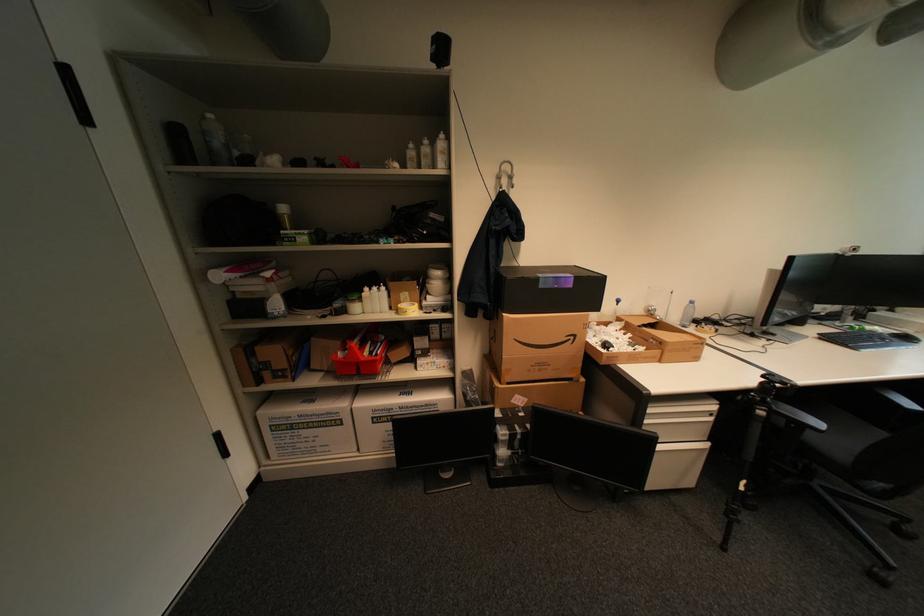
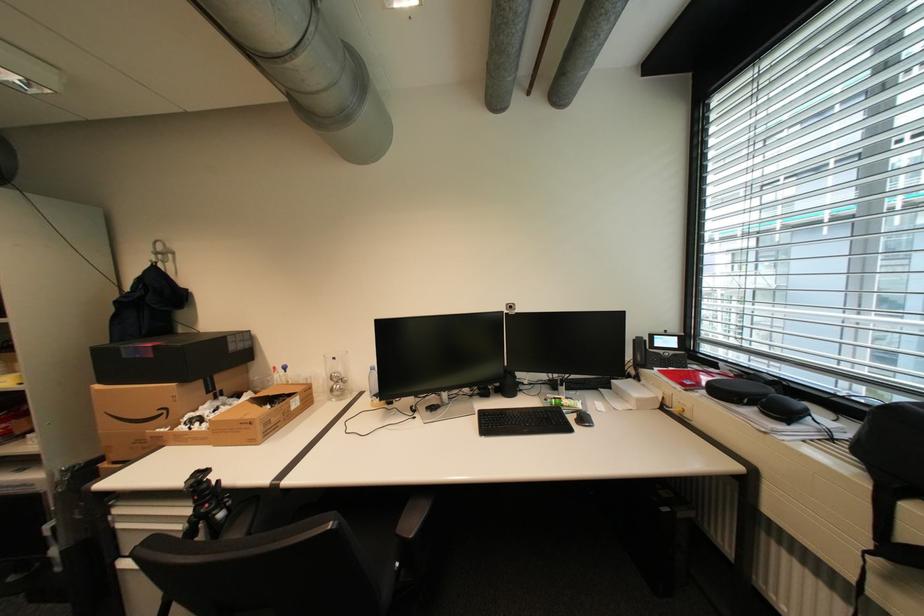
Find the pixel in the second image that matches (x=579, y=286) in the first image.

(161, 357)